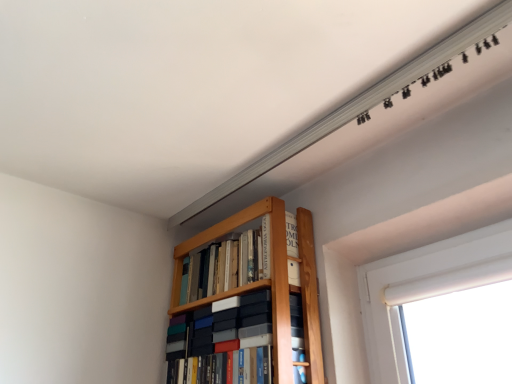
What do you see at coordinates (220, 267) in the screenshot? Image resolution: width=512 pixels, height=384 pixels. I see `wooden bookshelf at upper center, which is the 2th book in bottom-to-top order` at bounding box center [220, 267].

Locate an element on the screen. The image size is (512, 384). wooden bookshelf at upper center, marked as the 1th book in a top-to-bottom arrangement is located at coordinates (220, 267).

What is the approximate height of matte black book at center, the 1th book in the bottom-to-top sequence?

10.52 inches.

The height and width of the screenshot is (384, 512). What do you see at coordinates (210, 342) in the screenshot?
I see `matte black book at center, the 1th book in the bottom-to-top sequence` at bounding box center [210, 342].

Where is `matte black book at center, the 1th book in the bottom-to-top sequence`? This screenshot has width=512, height=384. matte black book at center, the 1th book in the bottom-to-top sequence is located at coordinates (210, 342).

At what (x,y) coordinates should I click in order to perform the action: click on wooden bookshelf at upper center, which is the 2th book in bottom-to-top order. Please return your answer as a coordinate pair (x, y). Looking at the image, I should click on click(220, 267).

Does wooden bookshelf at upper center, which is the 2th book in bottom-to-top order, appear on the left side of matte black book at center, the 1th book in the bottom-to-top sequence?

Incorrect, wooden bookshelf at upper center, which is the 2th book in bottom-to-top order, is not on the left side of matte black book at center, the 1th book in the bottom-to-top sequence.

Considering the positions of objects wooden bookshelf at upper center, marked as the 1th book in a top-to-bottom arrangement, and matte black book at center, the 2th book when ordered from top to bottom, in the image provided, who is behind, wooden bookshelf at upper center, marked as the 1th book in a top-to-bottom arrangement, or matte black book at center, the 2th book when ordered from top to bottom,?

wooden bookshelf at upper center, marked as the 1th book in a top-to-bottom arrangement, is further from the camera.

Which is closer, (249, 275) or (177, 360)?

The point (249, 275) is in front.

From the image's perspective, who appears lower, wooden bookshelf at upper center, which is the 2th book in bottom-to-top order, or matte black book at center, the 1th book in the bottom-to-top sequence?

From the image's view, matte black book at center, the 1th book in the bottom-to-top sequence, is below.

From a real-world perspective, does wooden bookshelf at upper center, marked as the 1th book in a top-to-bottom arrangement, sit lower than matte black book at center, the 1th book in the bottom-to-top sequence?

No, from a real-world perspective, wooden bookshelf at upper center, marked as the 1th book in a top-to-bottom arrangement, is not beneath matte black book at center, the 1th book in the bottom-to-top sequence.

Is wooden bookshelf at upper center, which is the 2th book in bottom-to-top order, wider or thinner than matte black book at center, the 2th book when ordered from top to bottom?

Clearly, wooden bookshelf at upper center, which is the 2th book in bottom-to-top order, has less width compared to matte black book at center, the 2th book when ordered from top to bottom.

Is wooden bookshelf at upper center, which is the 2th book in bottom-to-top order, taller or shorter than matte black book at center, the 1th book in the bottom-to-top sequence?

In the image, wooden bookshelf at upper center, which is the 2th book in bottom-to-top order, appears to be shorter than matte black book at center, the 1th book in the bottom-to-top sequence.

Considering the sizes of wooden bookshelf at upper center, which is the 2th book in bottom-to-top order, and matte black book at center, the 2th book when ordered from top to bottom, in the image, is wooden bookshelf at upper center, which is the 2th book in bottom-to-top order, bigger or smaller than matte black book at center, the 2th book when ordered from top to bottom,?

Considering their sizes, wooden bookshelf at upper center, which is the 2th book in bottom-to-top order, takes up less space than matte black book at center, the 2th book when ordered from top to bottom.

Is matte black book at center, the 1th book in the bottom-to-top sequence, completely or partially inside wooden bookshelf at upper center, which is the 2th book in bottom-to-top order?

Actually, matte black book at center, the 1th book in the bottom-to-top sequence, is outside wooden bookshelf at upper center, which is the 2th book in bottom-to-top order.

Is wooden bookshelf at upper center, marked as the 1th book in a top-to-bottom arrangement, far from matte black book at center, the 1th book in the bottom-to-top sequence?

No, wooden bookshelf at upper center, marked as the 1th book in a top-to-bottom arrangement, is in close proximity to matte black book at center, the 1th book in the bottom-to-top sequence.

Is wooden bookshelf at upper center, marked as the 1th book in a top-to-bottom arrangement, facing away from matte black book at center, the 1th book in the bottom-to-top sequence?

No, wooden bookshelf at upper center, marked as the 1th book in a top-to-bottom arrangement,'s orientation is not away from matte black book at center, the 1th book in the bottom-to-top sequence.

How distant is wooden bookshelf at upper center, marked as the 1th book in a top-to-bottom arrangement, from matte black book at center, the 1th book in the bottom-to-top sequence?

They are 7.02 inches apart.

The width and height of the screenshot is (512, 384). Identify the location of book that is behind the matte black book at center, the 2th book when ordered from top to bottom. (220, 267).

Based on their positions, is matte black book at center, the 2th book when ordered from top to bottom, located to the left or right of wooden bookshelf at upper center, marked as the 1th book in a top-to-bottom arrangement?

In the image, matte black book at center, the 2th book when ordered from top to bottom, appears on the left side of wooden bookshelf at upper center, marked as the 1th book in a top-to-bottom arrangement.

Is matte black book at center, the 1th book in the bottom-to-top sequence, further to the viewer compared to wooden bookshelf at upper center, which is the 2th book in bottom-to-top order?

No, matte black book at center, the 1th book in the bottom-to-top sequence, is in front of wooden bookshelf at upper center, which is the 2th book in bottom-to-top order.

Which is closer to the camera, (234, 309) or (262, 262)?

The point (234, 309) is more forward.

From the image's perspective, which is above, matte black book at center, the 1th book in the bottom-to-top sequence, or wooden bookshelf at upper center, which is the 2th book in bottom-to-top order?

wooden bookshelf at upper center, which is the 2th book in bottom-to-top order, appears higher in the image.

From a real-world perspective, is matte black book at center, the 1th book in the bottom-to-top sequence, positioned under wooden bookshelf at upper center, which is the 2th book in bottom-to-top order, based on gravity?

Yes, from a real-world perspective, matte black book at center, the 1th book in the bottom-to-top sequence, is under wooden bookshelf at upper center, which is the 2th book in bottom-to-top order.

Which of these two, matte black book at center, the 2th book when ordered from top to bottom, or wooden bookshelf at upper center, marked as the 1th book in a top-to-bottom arrangement, is thinner?

wooden bookshelf at upper center, marked as the 1th book in a top-to-bottom arrangement.

Is matte black book at center, the 1th book in the bottom-to-top sequence, taller or shorter than wooden bookshelf at upper center, which is the 2th book in bottom-to-top order?

Result: Considering their sizes, matte black book at center, the 1th book in the bottom-to-top sequence, has more height than wooden bookshelf at upper center, which is the 2th book in bottom-to-top order.

Can you confirm if matte black book at center, the 2th book when ordered from top to bottom, is smaller than wooden bookshelf at upper center, which is the 2th book in bottom-to-top order?

Incorrect, matte black book at center, the 2th book when ordered from top to bottom, is not smaller in size than wooden bookshelf at upper center, which is the 2th book in bottom-to-top order.

Is matte black book at center, the 2th book when ordered from top to bottom, situated inside wooden bookshelf at upper center, marked as the 1th book in a top-to-bottom arrangement, or outside?

matte black book at center, the 2th book when ordered from top to bottom, cannot be found inside wooden bookshelf at upper center, marked as the 1th book in a top-to-bottom arrangement.

Is matte black book at center, the 1th book in the bottom-to-top sequence, next to wooden bookshelf at upper center, which is the 2th book in bottom-to-top order, and touching it?

No, matte black book at center, the 1th book in the bottom-to-top sequence, is not with wooden bookshelf at upper center, which is the 2th book in bottom-to-top order.

Is matte black book at center, the 2th book when ordered from top to bottom, looking in the opposite direction of wooden bookshelf at upper center, marked as the 1th book in a top-to-bottom arrangement?

No, wooden bookshelf at upper center, marked as the 1th book in a top-to-bottom arrangement, is not at the back of matte black book at center, the 2th book when ordered from top to bottom.

What's the angular difference between matte black book at center, the 1th book in the bottom-to-top sequence, and wooden bookshelf at upper center, marked as the 1th book in a top-to-bottom arrangement,'s facing directions?

They differ by 0.00143 degrees in their facing directions.

In order to click on book located below the wooden bookshelf at upper center, which is the 2th book in bottom-to-top order (from the image's perspective) in this screenshot , I will do `click(210, 342)`.

This screenshot has width=512, height=384. Identify the location of book that is above the matte black book at center, the 2th book when ordered from top to bottom (from the image's perspective). (220, 267).

Locate an element on the screen. The width and height of the screenshot is (512, 384). book on the left of wooden bookshelf at upper center, marked as the 1th book in a top-to-bottom arrangement is located at coordinates (210, 342).